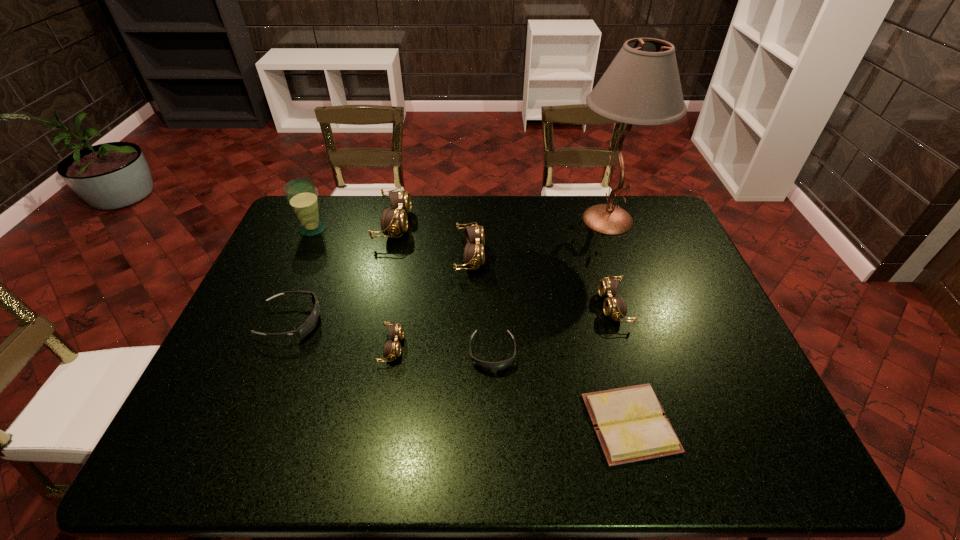
Where is `table lamp`? table lamp is located at coordinates (642, 86).

At what (x,y) coordinates should I click in order to perform the action: click on the second tallest object. Please return your answer as a coordinate pair (x, y). Looking at the image, I should click on (302, 196).

Locate an element on the screen. The height and width of the screenshot is (540, 960). glass is located at coordinates (302, 196).

Find the location of a particular element. The height and width of the screenshot is (540, 960). the biggest brown goggles is located at coordinates (393, 221).

Identify the location of the tallest goggles. (393, 221).

Identify the location of the second brown goggles from right to left. (474, 255).

The height and width of the screenshot is (540, 960). Find the location of `the fifth shortest goggles`. the fifth shortest goggles is located at coordinates point(474,255).

Where is `the rightmost brown goggles`? This screenshot has height=540, width=960. the rightmost brown goggles is located at coordinates (614, 307).

Image resolution: width=960 pixels, height=540 pixels. Find the location of `the third tallest goggles`. the third tallest goggles is located at coordinates (614, 307).

Identify the location of the bigger black goggles. (310, 323).